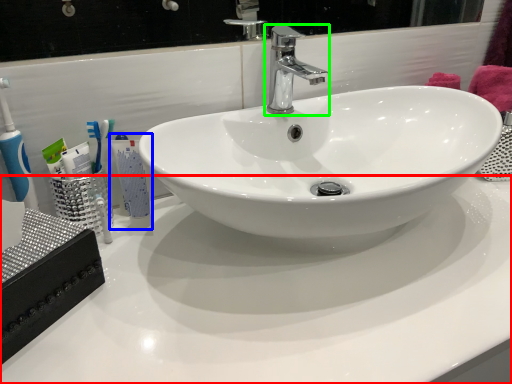
Question: Estimate the real-world distances between objects in this image. Which object is farther from counter top (highlighted by a red box), mouthwash (highlighted by a blue box) or tap (highlighted by a green box)?

Choices:
 (A) mouthwash
 (B) tap

Answer: (B)